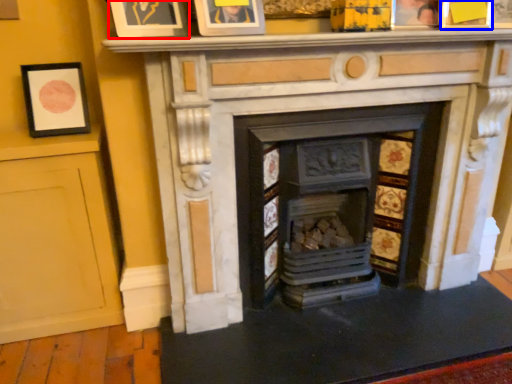
Question: Which object appears closest to the camera in this image, picture frame (highlighted by a red box) or picture frame (highlighted by a blue box)?

Choices:
 (A) picture frame
 (B) picture frame

Answer: (A)